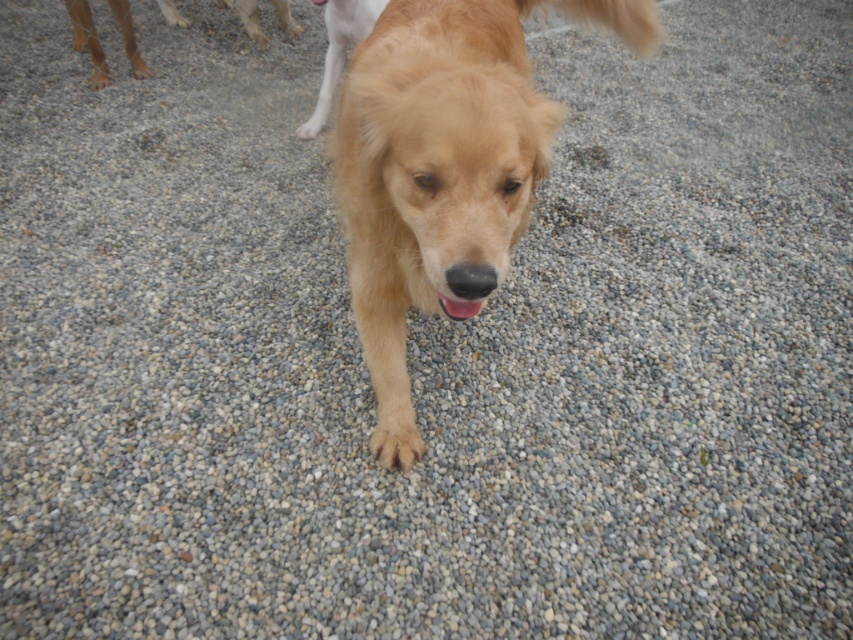
You are a photographer trying to capture the golden retriever in the image. You notice two points marked in the scene. Which point, point (380, 118) or point (280, 26), is closer to your camera lens?

Point (380, 118) is closer to the viewer than point (280, 26), so it is closer to your camera lens.